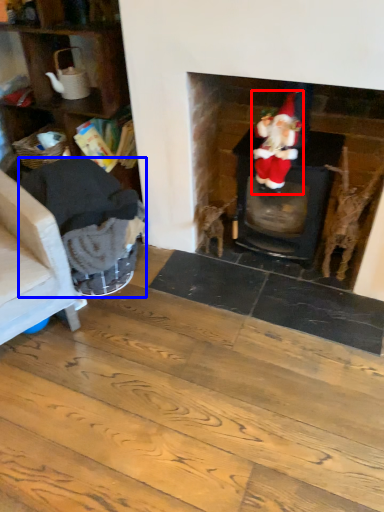
Question: Among these objects, which one is nearest to the camera, person (highlighted by a red box) or armchair (highlighted by a blue box)?

Choices:
 (A) person
 (B) armchair

Answer: (B)